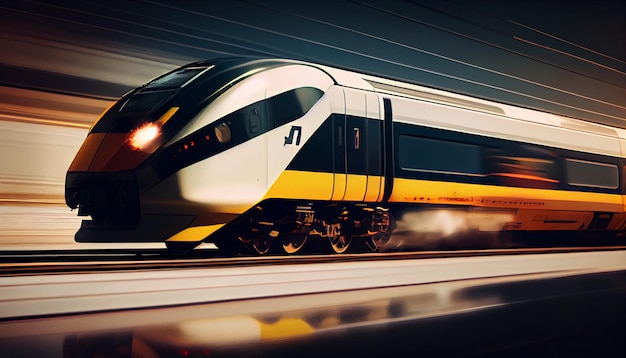
Identify the location of side windows. This screenshot has width=626, height=358. (441, 149), (578, 167).